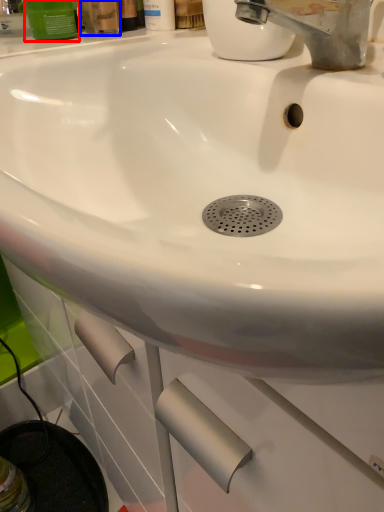
Question: Which point is closer to the camera, mouthwash (highlighted by a red box) or mouthwash (highlighted by a blue box)?

Choices:
 (A) mouthwash
 (B) mouthwash

Answer: (B)